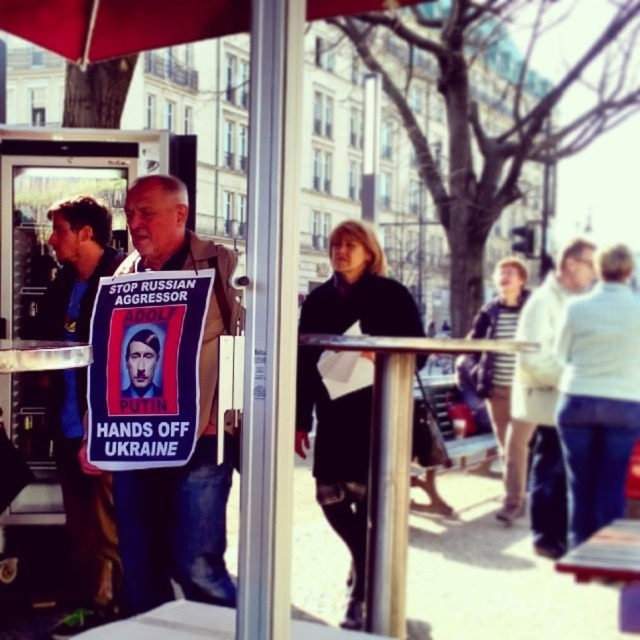
Can you confirm if blue fabric poster at center is bigger than red fabric umbrella at upper left?

Correct, blue fabric poster at center is larger in size than red fabric umbrella at upper left.

Measure the distance between blue fabric poster at center and red fabric umbrella at upper left.

blue fabric poster at center and red fabric umbrella at upper left are 36.87 inches apart.

Locate an element on the screen. Image resolution: width=640 pixels, height=640 pixels. blue fabric poster at center is located at coordinates (145, 369).

You are a GUI agent. You are given a task and a screenshot of the screen. Output one action in this format:
    pyautogui.click(x=<x>, y=<y>)
    Task: Click on the blue fabric poster at center
    The height and width of the screenshot is (640, 640).
    Given the screenshot: What is the action you would take?
    pyautogui.click(x=145, y=369)

Between point (168, 525) and point (77, 468), which one is positioned behind?

The point (77, 468) is behind.

Is matte cardboard sign at center wider than matte black sign at center?

In fact, matte cardboard sign at center might be narrower than matte black sign at center.

At what (x,y) coordinates should I click in order to perform the action: click on matte cardboard sign at center. Please return your answer as a coordinate pair (x, y). Image resolution: width=640 pixels, height=640 pixels. Looking at the image, I should click on (196, 428).

How distant is matte cardboard sign at center from red fabric umbrella at upper left?

38.45 inches

Is point (209, 404) behind point (212, 19)?

Yes, point (209, 404) is behind point (212, 19).

Which is behind, point (182, 577) or point (150, 28)?

The point (182, 577) is behind.

Where is `matte cardboard sign at center`? The height and width of the screenshot is (640, 640). matte cardboard sign at center is located at coordinates (196, 428).